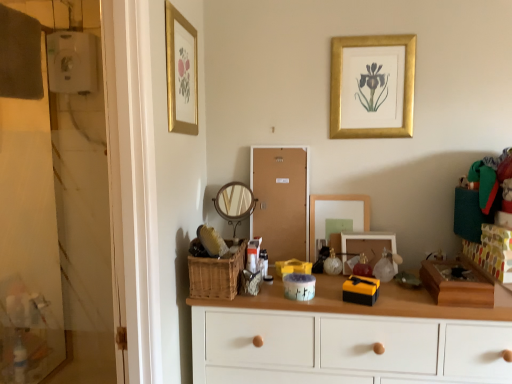
This screenshot has height=384, width=512. I want to click on free space above woven brown basket at center (from a real-world perspective), so click(x=221, y=253).